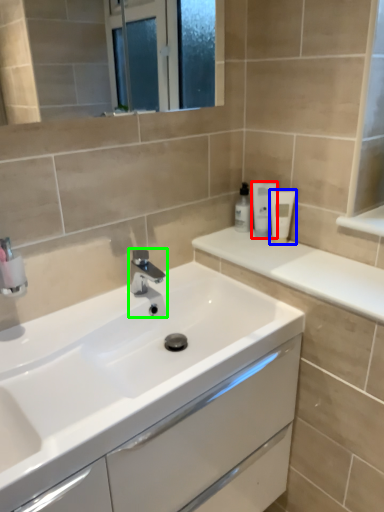
Question: Based on their relative distances, which object is nearer to toiletry (highlighted by a red box)? Choose from toiletry (highlighted by a blue box) and tap (highlighted by a green box).

Choices:
 (A) toiletry
 (B) tap

Answer: (A)